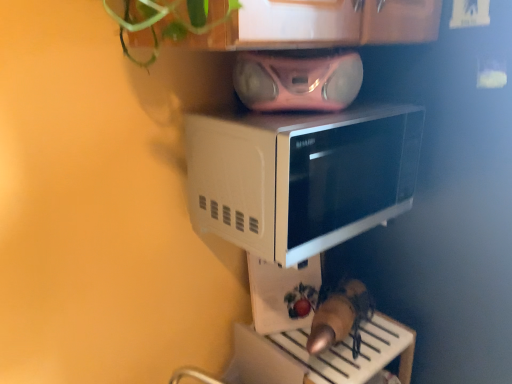
Identify the location of free space underneath pink metallic stereo at upper center (from a real-world perspective). The width and height of the screenshot is (512, 384). (305, 114).